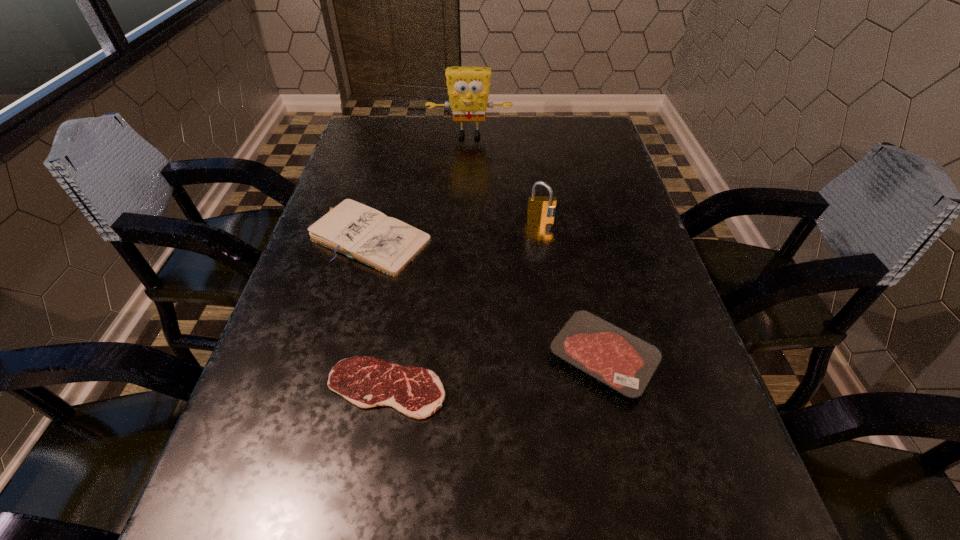
Where is `free location at the far left corner of the desktop`? Image resolution: width=960 pixels, height=540 pixels. free location at the far left corner of the desktop is located at coordinates (380, 153).

Identify the location of vacant area at the far right corner of the desktop. (584, 123).

Identify the location of empty space that is in between the shortest object and the padlock. The width and height of the screenshot is (960, 540). (464, 305).

I want to click on vacant region between the tallest object and the notebook, so click(420, 187).

This screenshot has width=960, height=540. What are the coordinates of `unoccupied position between the fourth shortest object and the tallest object` in the screenshot? It's located at (505, 178).

Where is `vacant space that is in between the taller steak and the padlock`? vacant space that is in between the taller steak and the padlock is located at coordinates (572, 289).

Identify the location of vacant region between the shorter steak and the third tallest object. (379, 313).

What are the coordinates of `free point between the fourth tallest object and the third shortest object` in the screenshot? It's located at (487, 298).

I want to click on empty space that is in between the notebook and the fourth shortest object, so click(456, 230).

The width and height of the screenshot is (960, 540). What are the coordinates of `vacant point located between the right steak and the left steak` in the screenshot? It's located at (494, 373).